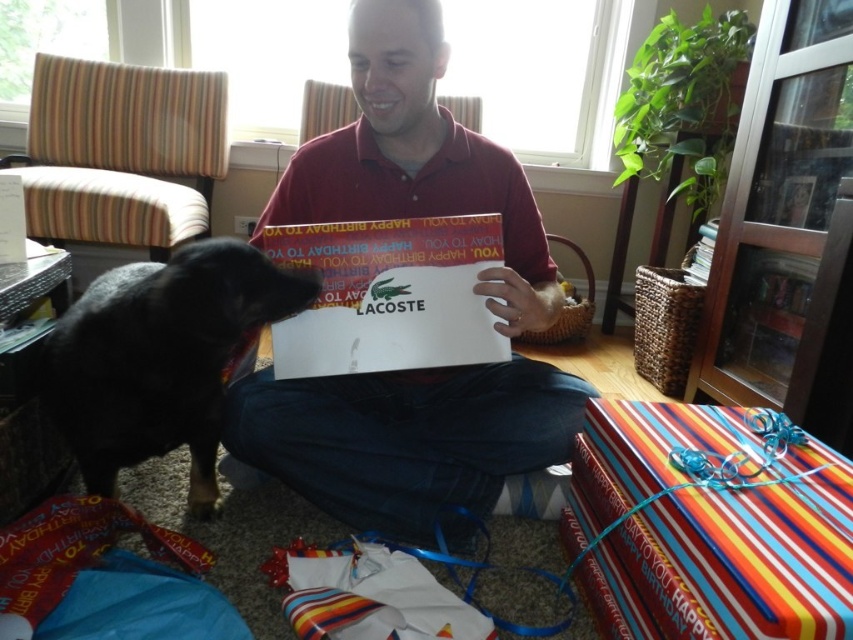
Does dark blue fabric at center come behind black fur dog at left?

Yes, it is behind black fur dog at left.

Consider the image. Does dark blue fabric at center have a greater height compared to black fur dog at left?

Incorrect, dark blue fabric at center's height is not larger of black fur dog at left's.

Which is in front, point (386, 387) or point (143, 412)?

Point (143, 412) is more forward.

Image resolution: width=853 pixels, height=640 pixels. In order to click on dark blue fabric at center in this screenshot , I will do `click(405, 440)`.

Measure the distance between matte red shirt at center and striped paper gift at lower right.

The distance of matte red shirt at center from striped paper gift at lower right is 15.14 inches.

Does matte red shirt at center appear on the left side of striped paper gift at lower right?

Indeed, matte red shirt at center is positioned on the left side of striped paper gift at lower right.

Who is more forward, (390, 42) or (714, 602)?

Point (714, 602) is more forward.

Find the location of a particular element. The height and width of the screenshot is (640, 853). matte red shirt at center is located at coordinates (405, 440).

Between striped paper gift at lower right and black fur dog at left, which one has less height?

With less height is striped paper gift at lower right.

Who is more forward, (651, 486) or (201, 364)?

Point (651, 486)

Locate an element on the screen. striped paper gift at lower right is located at coordinates (720, 524).